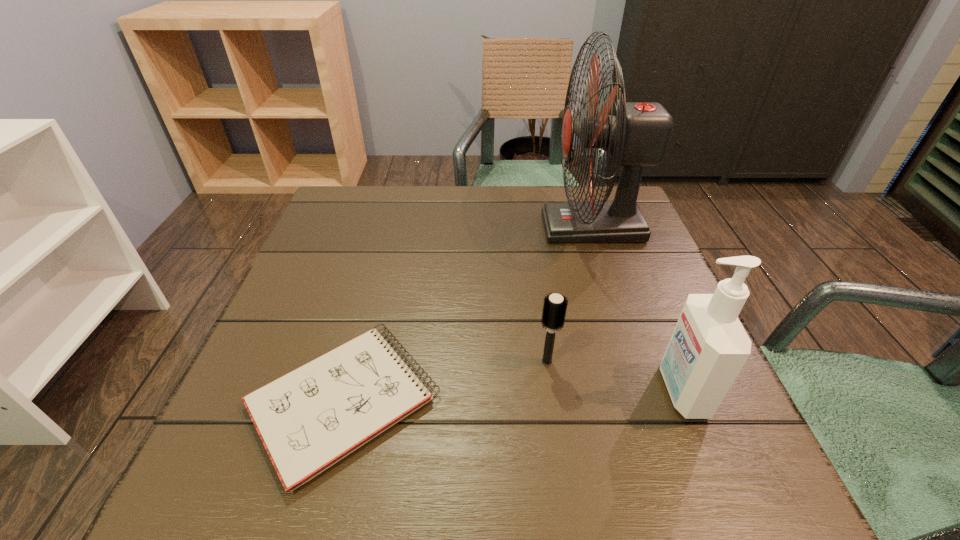
You are a GUI agent. You are given a task and a screenshot of the screen. Output one action in this format:
    pyautogui.click(x=<x>, y=<y>)
    Task: Click on the unoccupied area between the third object from right to left and the leftmost object
    
    Given the screenshot: What is the action you would take?
    pyautogui.click(x=445, y=382)

Image resolution: width=960 pixels, height=540 pixels. Find the location of `blank region between the tallest object and the third shortest object`. blank region between the tallest object and the third shortest object is located at coordinates (636, 309).

The image size is (960, 540). What are the coordinates of `unoccupied area between the farthest object and the second tallest object` in the screenshot? It's located at (636, 309).

Locate an element on the screen. vacant area between the second shortest object and the fan is located at coordinates (569, 294).

Locate an element on the screen. This screenshot has height=540, width=960. empty location between the cleansing agent and the notepad is located at coordinates (513, 396).

This screenshot has width=960, height=540. I want to click on unoccupied position between the tallest object and the third object from right to left, so click(x=569, y=294).

I want to click on free area in between the leftmost object and the third object from right to left, so click(x=445, y=382).

You are a GUI agent. You are given a task and a screenshot of the screen. Output one action in this format:
    pyautogui.click(x=<x>, y=<y>)
    Task: Click on the object that stands as the closest to the farthest object
    
    Given the screenshot: What is the action you would take?
    pyautogui.click(x=554, y=308)

Where is `object that is the nearest to the farthest object`? Image resolution: width=960 pixels, height=540 pixels. object that is the nearest to the farthest object is located at coordinates (554, 308).

Find the location of a particular element. vacant region that satisfies the following two spatial constraints: 1. on the front-facing side of the farthest object; 2. on the front side of the shortest object is located at coordinates (651, 402).